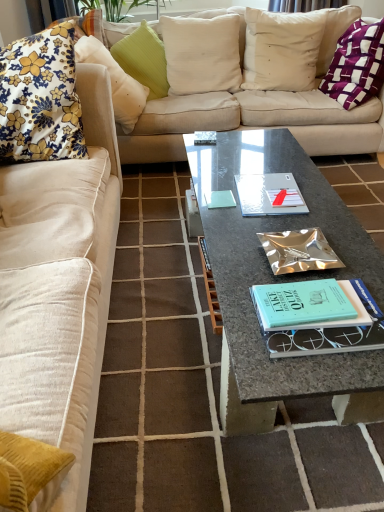
Find the location of `spots to the right of silver metallic notebook at center`. spots to the right of silver metallic notebook at center is located at coordinates (325, 200).